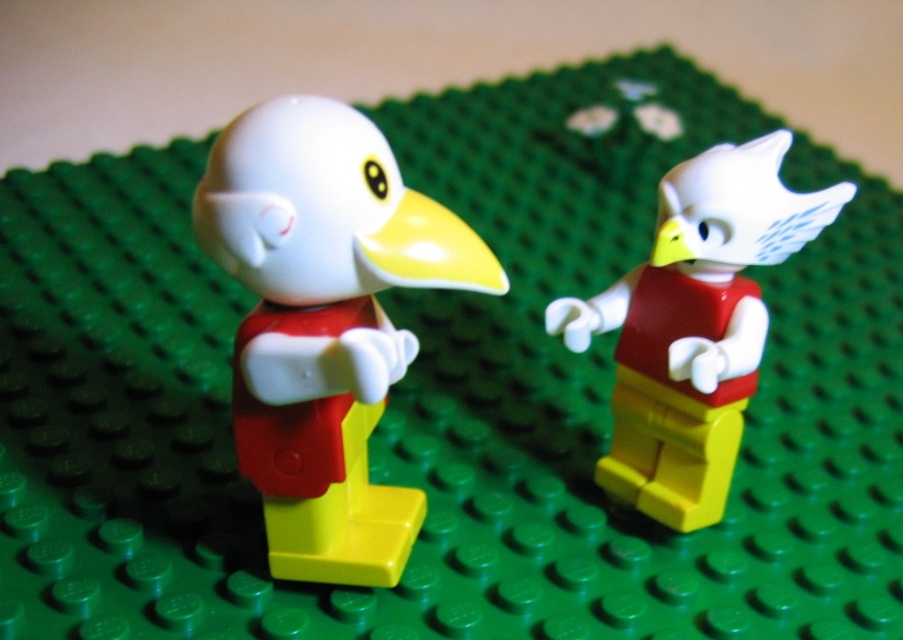
Question: Which point is closer to the camera taking this photo?

Choices:
 (A) (727, 202)
 (B) (266, 268)

Answer: (B)

Question: Can you confirm if matte plastic bird at center is wider than matte red torso at center?

Choices:
 (A) yes
 (B) no

Answer: (B)

Question: Which point is closer to the camera?

Choices:
 (A) (649, 280)
 (B) (374, 285)

Answer: (B)

Question: Which of the following is the closest to the observer?

Choices:
 (A) (382, 173)
 (B) (653, 384)

Answer: (A)

Question: Does matte plastic bird at center come behind matte red torso at center?

Choices:
 (A) yes
 (B) no

Answer: (B)

Question: Does matte plastic bird at center appear on the left side of matte red torso at center?

Choices:
 (A) yes
 (B) no

Answer: (A)